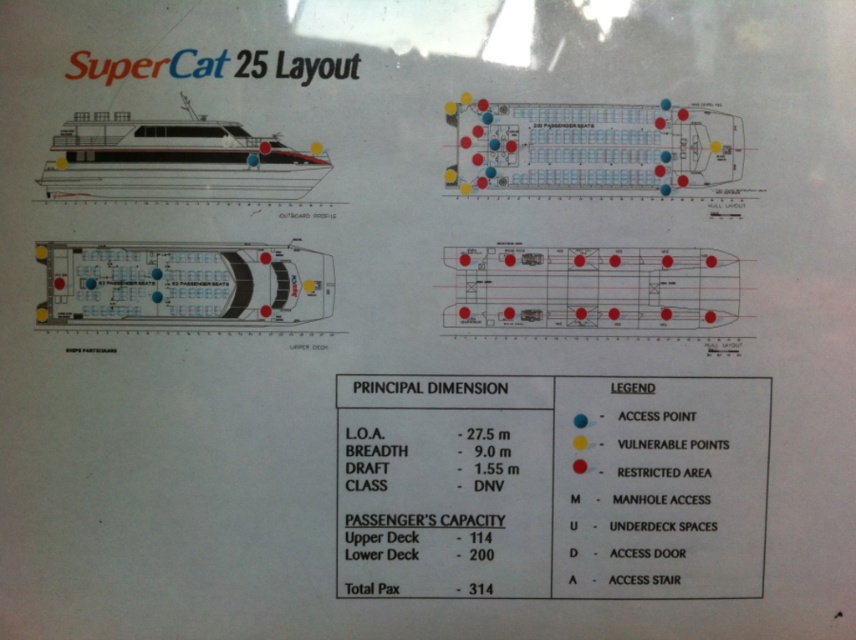
Consider the image. Does white plastic boat at center come behind white glossy ship at upper left?

Yes, it is.

Where is `white plastic boat at center`? The height and width of the screenshot is (640, 856). white plastic boat at center is located at coordinates (183, 284).

Who is more forward, (64, 244) or (96, 195)?

Positioned in front is point (64, 244).

In order to click on white plastic boat at center in this screenshot , I will do `click(183, 284)`.